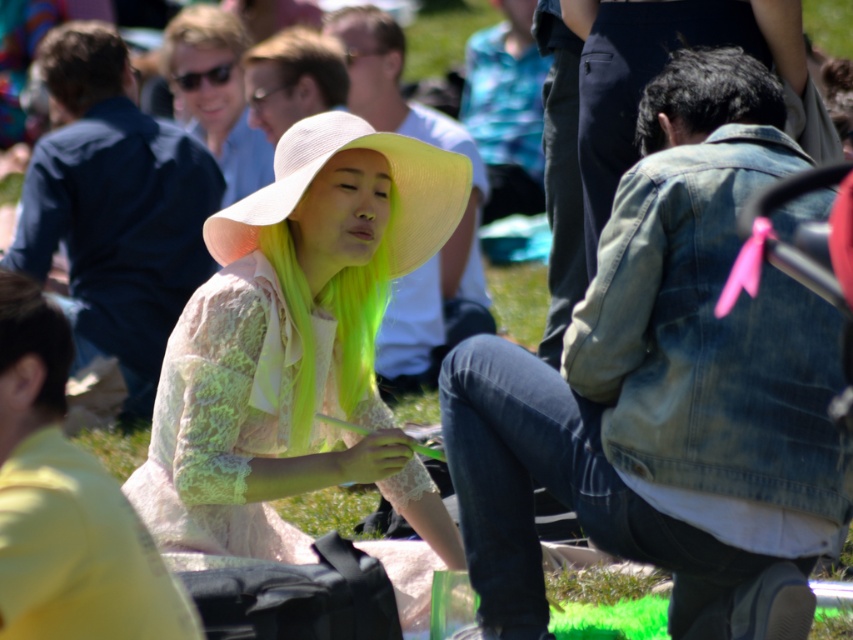
Question: Can you confirm if faded denim jacket at lower right is positioned to the right of light brown hair at upper center?

Choices:
 (A) yes
 (B) no

Answer: (A)

Question: Which point is farther to the camera?

Choices:
 (A) (729, 109)
 (B) (804, 552)
 (C) (207, 436)

Answer: (C)

Question: Considering the relative positions of light pink lace dress at center and light brown hair at upper center in the image provided, where is light pink lace dress at center located with respect to light brown hair at upper center?

Choices:
 (A) above
 (B) below

Answer: (B)

Question: Which object appears farthest from the camera in this image?

Choices:
 (A) faded denim jacket at lower right
 (B) dark brown hair at upper right

Answer: (B)

Question: Is faded denim jacket at lower right below light pink lace dress at center?

Choices:
 (A) yes
 (B) no

Answer: (B)

Question: Which point is closer to the camera?

Choices:
 (A) (738, 122)
 (B) (85, 48)

Answer: (A)